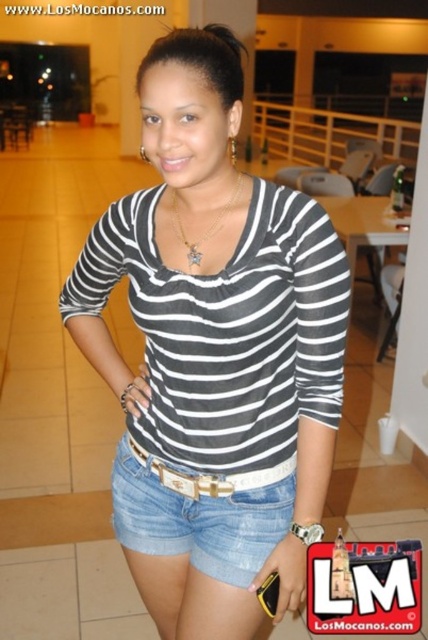
Based on the photo, does striped fabric shirt at center have a smaller size compared to denim shorts at center?

Actually, striped fabric shirt at center might be larger than denim shorts at center.

Is the position of striped fabric shirt at center less distant than that of denim shorts at center?

Yes.

Find the location of a particular element. This screenshot has width=428, height=640. striped fabric shirt at center is located at coordinates (214, 349).